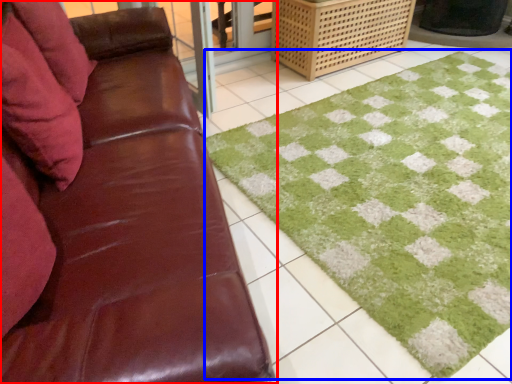
Question: Among these objects, which one is nearest to the camera, studio couch (highlighted by a red box) or bath mat (highlighted by a blue box)?

Choices:
 (A) studio couch
 (B) bath mat

Answer: (A)